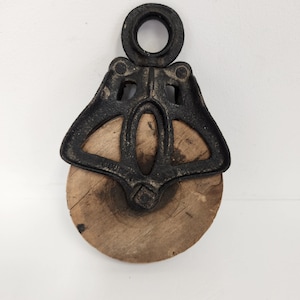
At what (x,y) coordinates should I click in order to perform the action: click on iron. Please return your answer as a coordinate pair (x, y). Looking at the image, I should click on (138, 185).